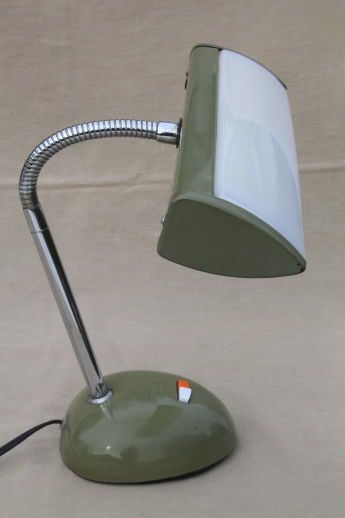
Find the location of `light`. light is located at coordinates (273, 136).